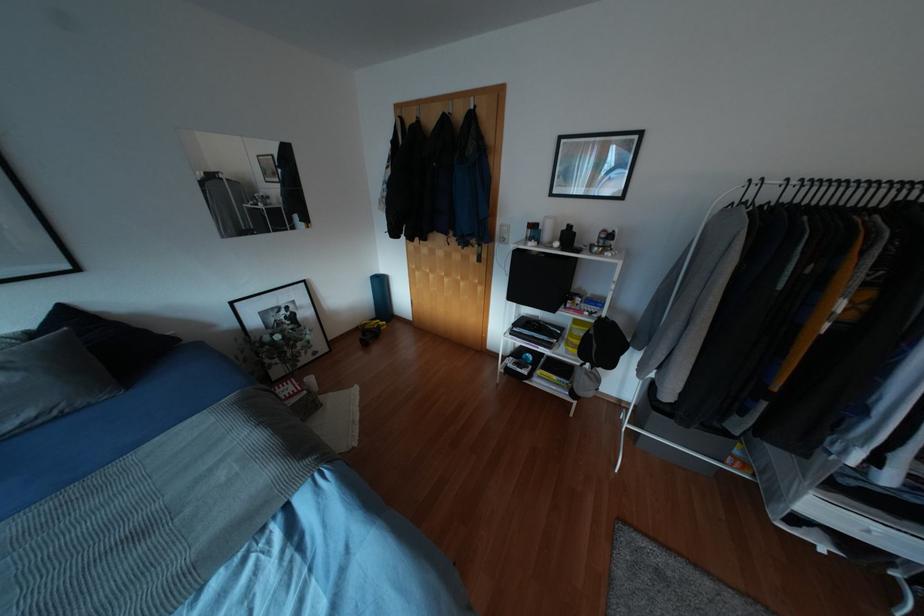
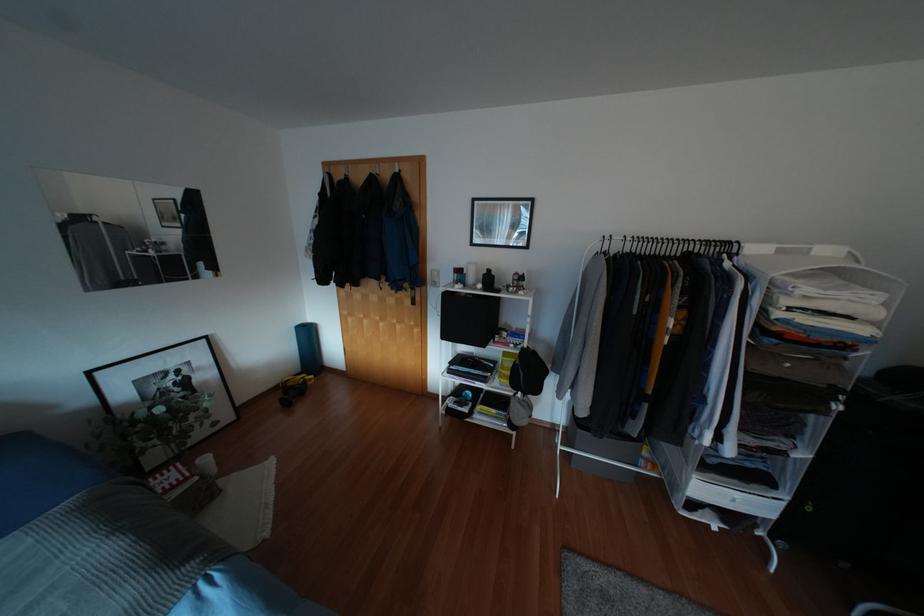
In the second image, find the point that corresponds to pixel 602 344 in the first image.

(528, 371)